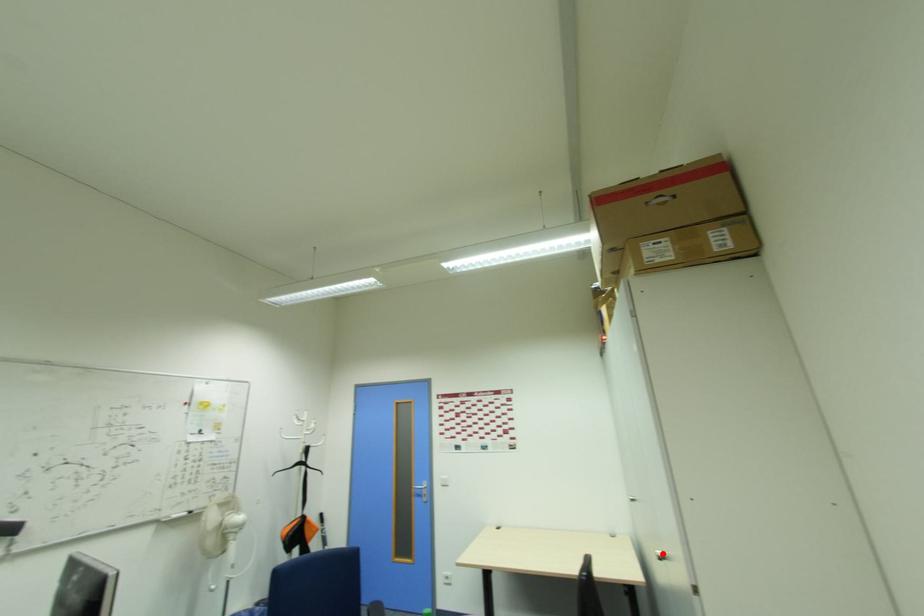
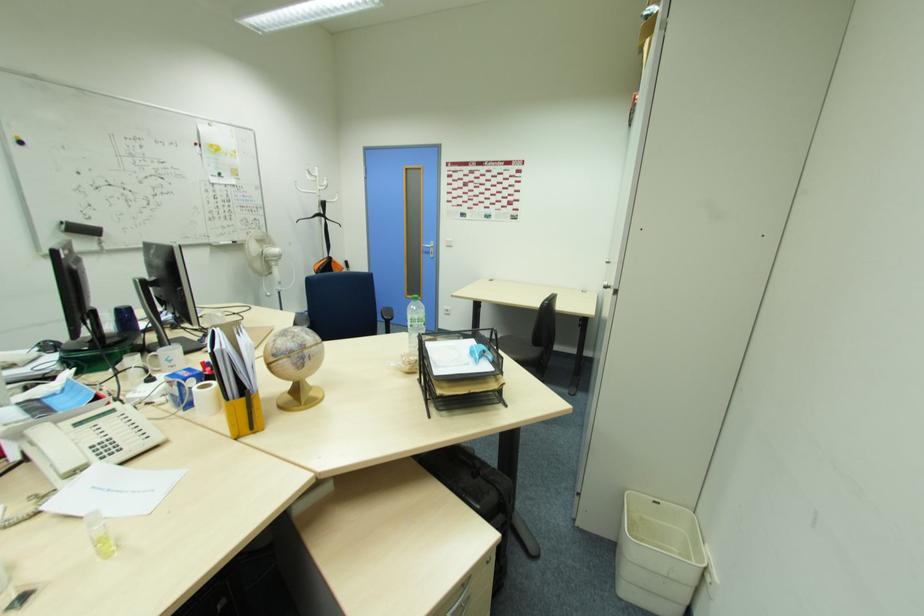
Question: I am providing you with two images of the same scene from different viewpoints. In image1, a red point is highlighted. Considering the same 3D point in image2, which of the following is correct?

Choices:
 (A) It is closer
 (B) It is farther

Answer: (A)